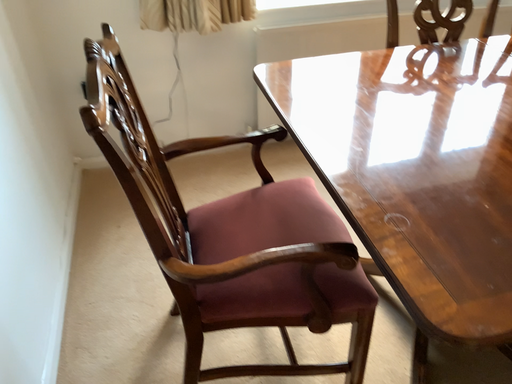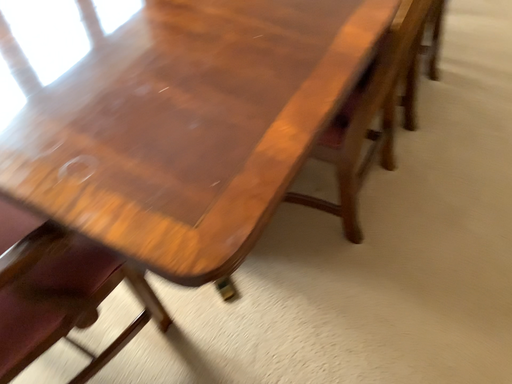
Question: How did the camera likely rotate when shooting the video?

Choices:
 (A) rotated right
 (B) rotated left

Answer: (A)